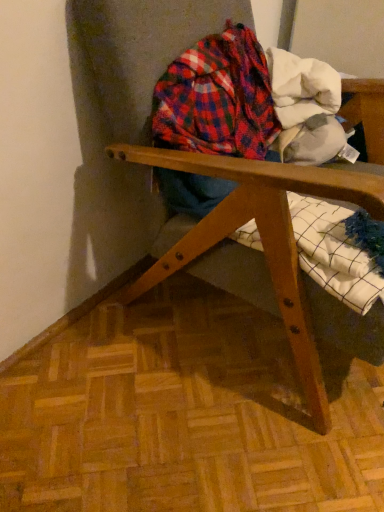
Image resolution: width=384 pixels, height=512 pixels. What do you see at coordinates (261, 237) in the screenshot?
I see `wooden chair at center` at bounding box center [261, 237].

Locate an element on the screen. Image resolution: width=384 pixels, height=512 pixels. wooden chair at center is located at coordinates (261, 237).

Measure the distance between point [147,273] and camera.

3.42 feet.

Where is `wooden chair at center`? The width and height of the screenshot is (384, 512). wooden chair at center is located at coordinates (261, 237).